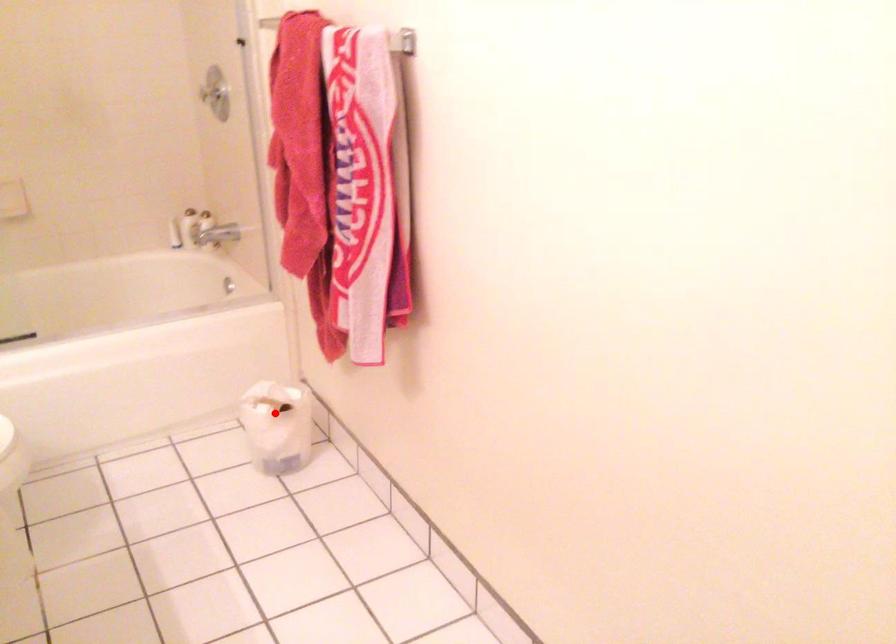
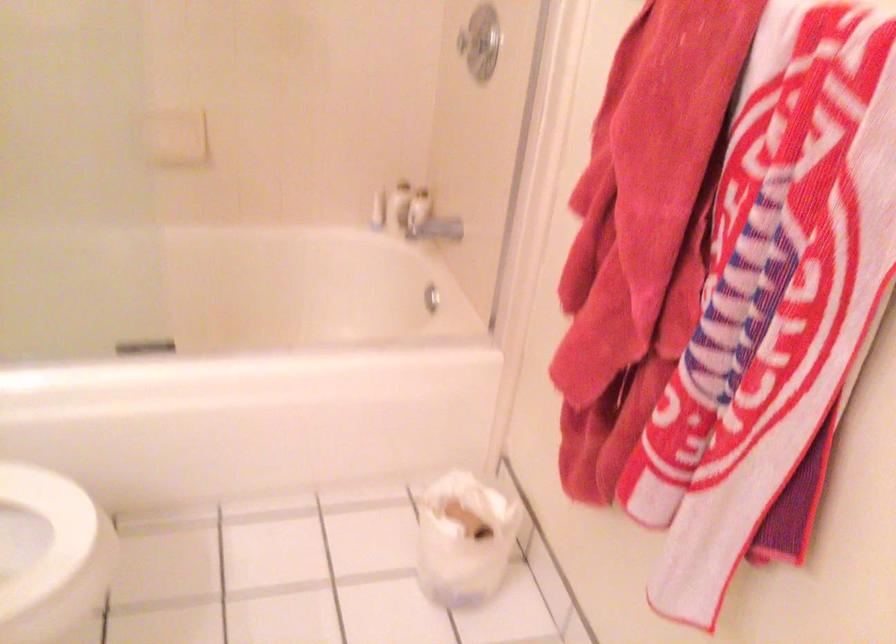
Find the pixel in the second image that matches the highlighted location in the first image.

(464, 538)